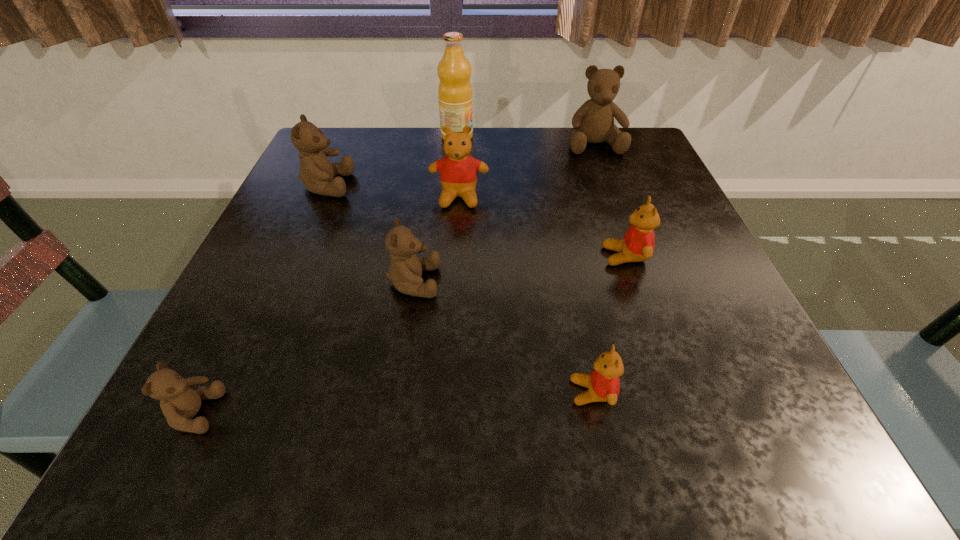
Locate an element on the screen. Image resolution: width=960 pixels, height=540 pixels. fruit juice is located at coordinates (455, 95).

Where is `the biggest brown teddy bear`? The height and width of the screenshot is (540, 960). the biggest brown teddy bear is located at coordinates (593, 122).

You are a GUI agent. You are given a task and a screenshot of the screen. Output one action in this format:
    pyautogui.click(x=<x>, y=<y>)
    Task: Click on the farthest brown teddy bear
    This screenshot has height=540, width=960.
    Given the screenshot: What is the action you would take?
    pyautogui.click(x=593, y=122)

Locate an element on the screen. The width and height of the screenshot is (960, 540). the third smallest brown teddy bear is located at coordinates (316, 171).

Find the location of a particular element. The width and height of the screenshot is (960, 540). the leftmost red teddy bear is located at coordinates (458, 171).

This screenshot has width=960, height=540. I want to click on the farthest red teddy bear, so click(458, 171).

Locate an element on the screen. the rightmost red teddy bear is located at coordinates (638, 243).

Where is `the second farthest red teddy bear`? the second farthest red teddy bear is located at coordinates (638, 243).

Where is `the third brown teddy bear from left to right`? the third brown teddy bear from left to right is located at coordinates (405, 271).

At what (x,y) coordinates should I click in order to perform the action: click on the third biggest brown teddy bear. Please return your answer as a coordinate pair (x, y). The width and height of the screenshot is (960, 540). Looking at the image, I should click on (405, 271).